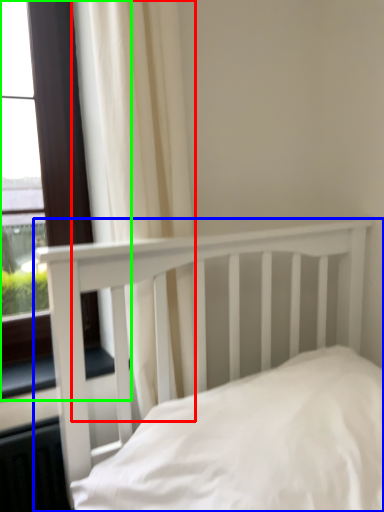
Question: Which object is the closest to the curtain (highlighted by a red box)? Choose among these: bed (highlighted by a blue box) or window (highlighted by a green box).

Choices:
 (A) bed
 (B) window

Answer: (A)